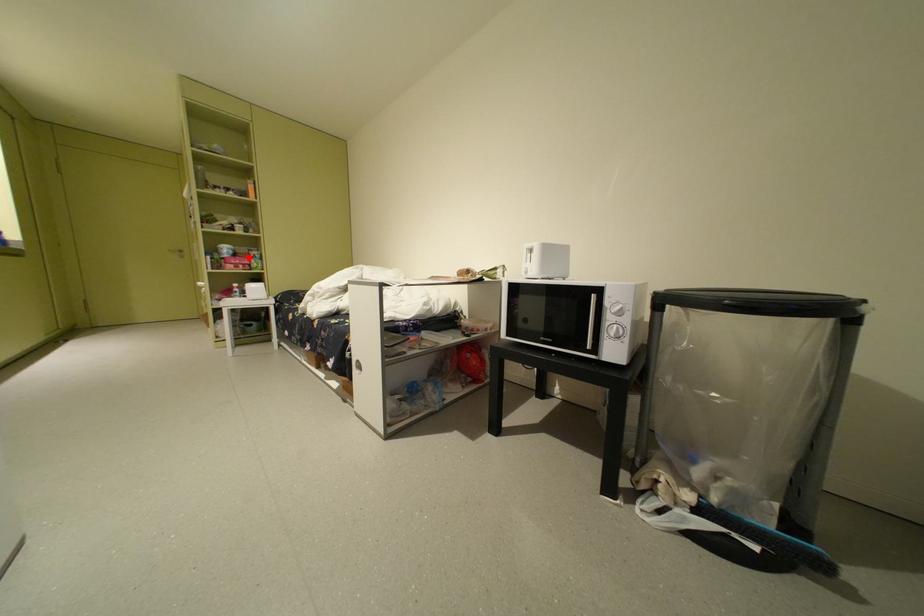
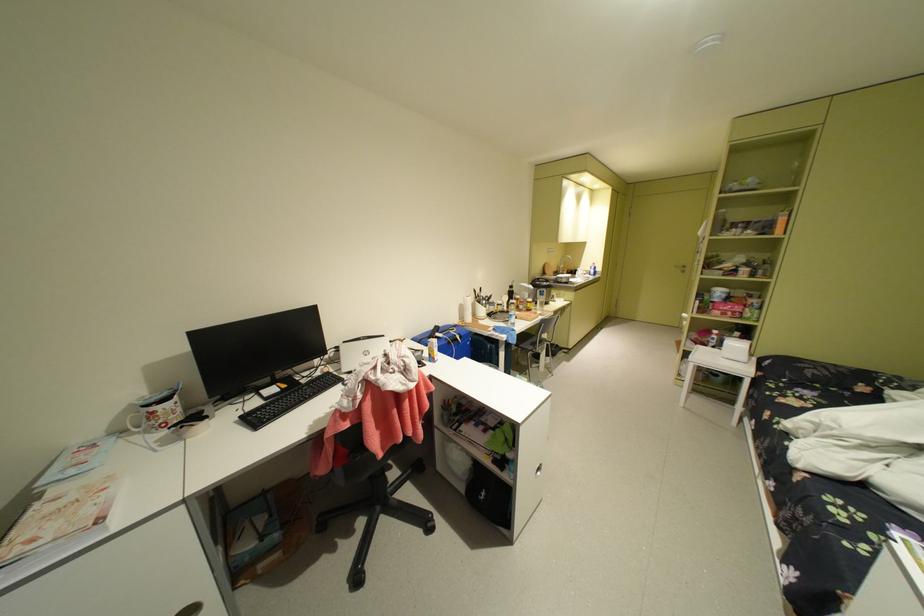
In the second image, find the point that corresponds to the highlighted location in the first image.

(740, 304)